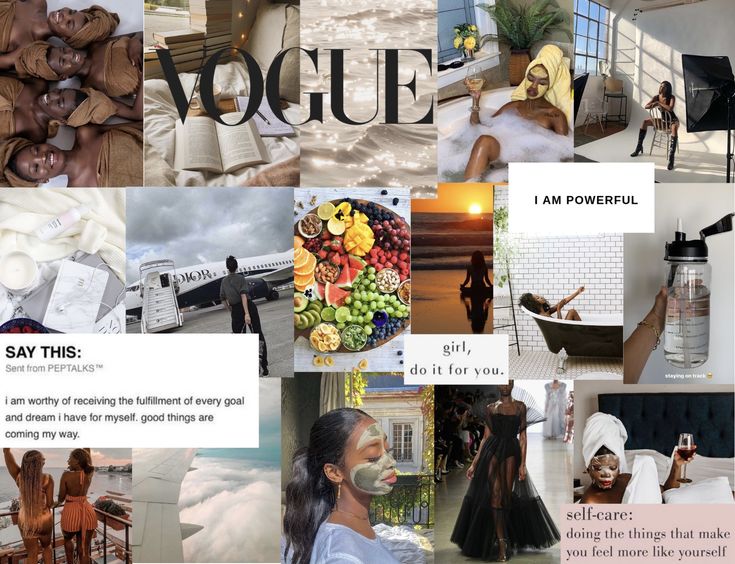
Where is `indoor photos`? This screenshot has width=735, height=564. indoor photos is located at coordinates (87, 58), (243, 28), (509, 38), (648, 47), (684, 231), (572, 280), (361, 279), (381, 504), (498, 472), (636, 461).